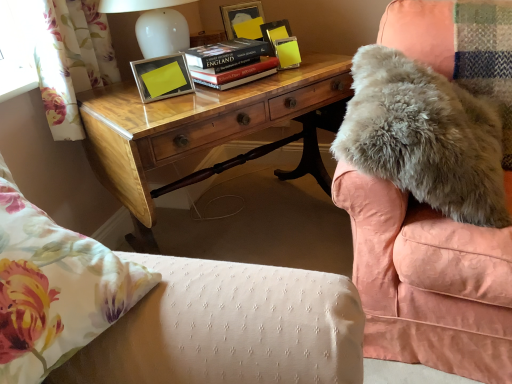
Question: From the image's perspective, does fuzzy gray blanket at upper right appear higher than hardcover book at center?

Choices:
 (A) yes
 (B) no

Answer: (B)

Question: Is fuzzy gray blanket at upper right thinner than hardcover book at center?

Choices:
 (A) no
 (B) yes

Answer: (A)

Question: Considering the relative positions of fuzzy gray blanket at upper right and hardcover book at center in the image provided, is fuzzy gray blanket at upper right in front of hardcover book at center?

Choices:
 (A) yes
 (B) no

Answer: (A)

Question: Is fuzzy gray blanket at upper right not inside hardcover book at center?

Choices:
 (A) yes
 (B) no

Answer: (A)

Question: From a real-world perspective, is fuzzy gray blanket at upper right over hardcover book at center?

Choices:
 (A) no
 (B) yes

Answer: (A)

Question: Does fuzzy gray blanket at upper right have a larger size compared to hardcover book at center?

Choices:
 (A) yes
 (B) no

Answer: (A)

Question: From a real-world perspective, is floral fabric pillow at lower left physically above metallic yellow picture frame at upper center?

Choices:
 (A) no
 (B) yes

Answer: (B)

Question: Is there a large distance between floral fabric pillow at lower left and metallic yellow picture frame at upper center?

Choices:
 (A) no
 (B) yes

Answer: (A)

Question: From a real-world perspective, is floral fabric pillow at lower left beneath metallic yellow picture frame at upper center?

Choices:
 (A) no
 (B) yes

Answer: (A)

Question: Does floral fabric pillow at lower left have a lesser height compared to metallic yellow picture frame at upper center?

Choices:
 (A) no
 (B) yes

Answer: (A)

Question: Considering the relative sizes of floral fabric pillow at lower left and metallic yellow picture frame at upper center in the image provided, is floral fabric pillow at lower left thinner than metallic yellow picture frame at upper center?

Choices:
 (A) yes
 (B) no

Answer: (B)

Question: Is floral fabric pillow at lower left bigger than metallic yellow picture frame at upper center?

Choices:
 (A) yes
 (B) no

Answer: (A)

Question: Is floral fabric pillow at lower left at the back of hardcover book at center?

Choices:
 (A) yes
 (B) no

Answer: (B)